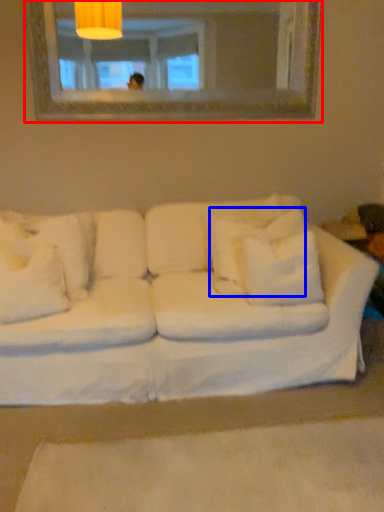
Question: Which object appears farthest to the camera in this image, mirror (highlighted by a red box) or pillow (highlighted by a blue box)?

Choices:
 (A) mirror
 (B) pillow

Answer: (A)